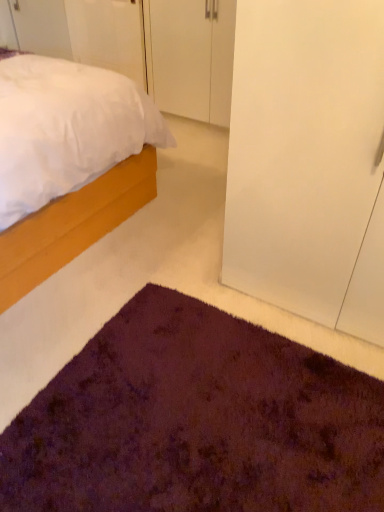
The image size is (384, 512). Describe the element at coordinates (196, 421) in the screenshot. I see `purple shaggy rug at lower center` at that location.

You are a GUI agent. You are given a task and a screenshot of the screen. Output one action in this format:
    pyautogui.click(x=<x>, y=<y>)
    Task: Click on the white matte cabinet at upper center, the 1th door viewed from the right
    The width and height of the screenshot is (384, 512).
    Given the screenshot: What is the action you would take?
    pos(193,57)

Where is `purple shaggy rug at lower center`? This screenshot has width=384, height=512. purple shaggy rug at lower center is located at coordinates (196, 421).

From a real-world perspective, is matte wood bed at left located beneath purple shaggy rug at lower center?

No, from a real-world perspective, matte wood bed at left is not under purple shaggy rug at lower center.

Is purple shaggy rug at lower center completely or partially inside matte wood bed at left?

No, purple shaggy rug at lower center is not inside matte wood bed at left.

Who is smaller, matte wood bed at left or purple shaggy rug at lower center?

With smaller size is purple shaggy rug at lower center.

Looking at this image, is matte wood bed at left further to the viewer compared to purple shaggy rug at lower center?

That is True.

In terms of width, does purple shaggy rug at lower center look wider or thinner when compared to transparent glass door at right?

Clearly, purple shaggy rug at lower center has more width compared to transparent glass door at right.

From a real-world perspective, between purple shaggy rug at lower center and transparent glass door at right, who is vertically lower?

From a 3D spatial view, purple shaggy rug at lower center is below.

Is point (39, 439) farther from viewer compared to point (330, 53)?

Yes, point (39, 439) is behind point (330, 53).

Looking at this image, from the image's perspective, is purple shaggy rug at lower center located beneath transparent glass door at right?

Correct, purple shaggy rug at lower center appears lower than transparent glass door at right in the image.

Would you say matte wood bed at left is outside transparent glass door at right?

Yes, matte wood bed at left is located beyond the bounds of transparent glass door at right.

Is matte wood bed at left looking in the opposite direction of transparent glass door at right?

That's not correct — matte wood bed at left is not looking away from transparent glass door at right.

Considering the relative sizes of transparent glass door at right and matte wood bed at left in the image provided, is transparent glass door at right wider than matte wood bed at left?

Incorrect, the width of transparent glass door at right does not surpass that of matte wood bed at left.

From the image's perspective, is transparent glass door at right beneath matte wood bed at left?

Indeed, from the image's perspective, transparent glass door at right is shown beneath matte wood bed at left.

Is point (182, 408) farther from viewer compared to point (73, 14)?

No, it is not.

From a real-world perspective, is purple shaggy rug at lower center above or below white matte door at upper left, the 1th door from the left?

Clearly, from a real-world perspective, purple shaggy rug at lower center is below white matte door at upper left, the 1th door from the left.

Considering their positions, is purple shaggy rug at lower center located in front of or behind white matte door at upper left, which is the 2th door in right-to-left order?

Visually, purple shaggy rug at lower center is located in front of white matte door at upper left, which is the 2th door in right-to-left order.

Can you confirm if purple shaggy rug at lower center is smaller than white matte door at upper left, the 1th door from the left?

No, purple shaggy rug at lower center is not smaller than white matte door at upper left, the 1th door from the left.

From their relative heights in the image, would you say white matte cabinet at upper center, marked as the 2th door in a left-to-right arrangement, is taller or shorter than transparent glass door at right?

In the image, white matte cabinet at upper center, marked as the 2th door in a left-to-right arrangement, appears to be shorter than transparent glass door at right.

Which of these two, white matte cabinet at upper center, the 1th door viewed from the right, or transparent glass door at right, is bigger?

transparent glass door at right.

Consider the image. Which object is positioned more to the right, white matte cabinet at upper center, the 1th door viewed from the right, or transparent glass door at right?

transparent glass door at right.

Is white matte cabinet at upper center, marked as the 2th door in a left-to-right arrangement, not inside transparent glass door at right?

Yes, white matte cabinet at upper center, marked as the 2th door in a left-to-right arrangement, is not within transparent glass door at right.

Is white matte door at upper left, which is the 2th door in right-to-left order, oriented towards purple shaggy rug at lower center?

No, white matte door at upper left, which is the 2th door in right-to-left order, is not turned towards purple shaggy rug at lower center.

Considering the relative positions of white matte door at upper left, which is the 2th door in right-to-left order, and purple shaggy rug at lower center in the image provided, is white matte door at upper left, which is the 2th door in right-to-left order, to the left or to the right of purple shaggy rug at lower center?

From the image, it's evident that white matte door at upper left, which is the 2th door in right-to-left order, is to the left of purple shaggy rug at lower center.

Is point (76, 50) farther from viewer compared to point (118, 449)?

Yes, point (76, 50) is behind point (118, 449).

In the scene shown: Can you confirm if white matte door at upper left, which is the 2th door in right-to-left order, is bigger than purple shaggy rug at lower center?

Actually, white matte door at upper left, which is the 2th door in right-to-left order, might be smaller than purple shaggy rug at lower center.

At what (x,y) coordinates should I click in order to perform the action: click on bed on the left of purple shaggy rug at lower center. Please return your answer as a coordinate pair (x, y). The width and height of the screenshot is (384, 512). Looking at the image, I should click on (72, 225).

Identify the location of doormat lying below the transparent glass door at right (from the image's perspective). (196, 421).

When comparing their distances from matte wood bed at left, does white matte cabinet at upper center, the 1th door viewed from the right, or white matte door at upper left, the 1th door from the left, seem further?

white matte door at upper left, the 1th door from the left, is further to matte wood bed at left.

Looking at the image, which one is located closer to white matte door at upper left, which is the 2th door in right-to-left order, matte wood bed at left or purple shaggy rug at lower center?

Based on the image, matte wood bed at left appears to be nearer to white matte door at upper left, which is the 2th door in right-to-left order.

Looking at the image, which one is located closer to transparent glass door at right, white matte door at upper left, the 1th door from the left, or white matte cabinet at upper center, marked as the 2th door in a left-to-right arrangement?

Based on the image, white matte cabinet at upper center, marked as the 2th door in a left-to-right arrangement, appears to be nearer to transparent glass door at right.

Considering their positions, is white matte cabinet at upper center, the 1th door viewed from the right, positioned closer to white matte door at upper left, which is the 2th door in right-to-left order, than transparent glass door at right?

white matte cabinet at upper center, the 1th door viewed from the right, lies closer to white matte door at upper left, which is the 2th door in right-to-left order, than the other object.

Based on the photo, based on their spatial positions, is white matte door at upper left, which is the 2th door in right-to-left order, or matte wood bed at left further from transparent glass door at right?

Based on the image, white matte door at upper left, which is the 2th door in right-to-left order, appears to be further to transparent glass door at right.

Based on their spatial positions, is transparent glass door at right or white matte cabinet at upper center, marked as the 2th door in a left-to-right arrangement, closer to matte wood bed at left?

Based on the image, transparent glass door at right appears to be nearer to matte wood bed at left.

Considering their positions, is white matte door at upper left, which is the 2th door in right-to-left order, positioned closer to white matte cabinet at upper center, marked as the 2th door in a left-to-right arrangement, than purple shaggy rug at lower center?

white matte door at upper left, which is the 2th door in right-to-left order, is closer to white matte cabinet at upper center, marked as the 2th door in a left-to-right arrangement.

Looking at the image, which one is located closer to matte wood bed at left, white matte cabinet at upper center, the 1th door viewed from the right, or transparent glass door at right?

transparent glass door at right.

Identify the location of doormat between matte wood bed at left and transparent glass door at right. The width and height of the screenshot is (384, 512). (196, 421).

The height and width of the screenshot is (512, 384). I want to click on door between white matte door at upper left, which is the 2th door in right-to-left order, and purple shaggy rug at lower center vertically, so click(193, 57).

The height and width of the screenshot is (512, 384). Find the location of `bed between transparent glass door at right and white matte door at upper left, which is the 2th door in right-to-left order, in the front-back direction`. bed between transparent glass door at right and white matte door at upper left, which is the 2th door in right-to-left order, in the front-back direction is located at coordinates (72, 225).

The image size is (384, 512). I want to click on door located between matte wood bed at left and white matte door at upper left, which is the 2th door in right-to-left order, in the depth direction, so click(x=193, y=57).